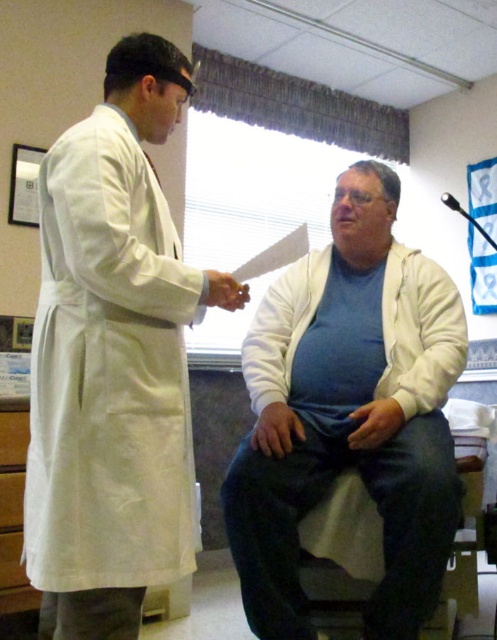
Question: Is the position of white smooth lab coat at left more distant than that of white fleece jacket at center?

Choices:
 (A) no
 (B) yes

Answer: (A)

Question: Which object is positioned closest to the white fleece jacket at center?

Choices:
 (A) white matte jacket at center
 (B) white smooth lab coat at left

Answer: (A)

Question: Which point appears closest to the camera in this image?

Choices:
 (A) tap(410, 280)
 (B) tap(393, 284)
 (C) tap(111, 216)

Answer: (C)

Question: Is white matte jacket at center smaller than white fleece jacket at center?

Choices:
 (A) yes
 (B) no

Answer: (B)

Question: Can you confirm if white smooth lab coat at left is thinner than white matte jacket at center?

Choices:
 (A) yes
 (B) no

Answer: (A)

Question: Among these points, which one is farthest from the camera?

Choices:
 (A) (261, 348)
 (B) (355, 388)

Answer: (A)